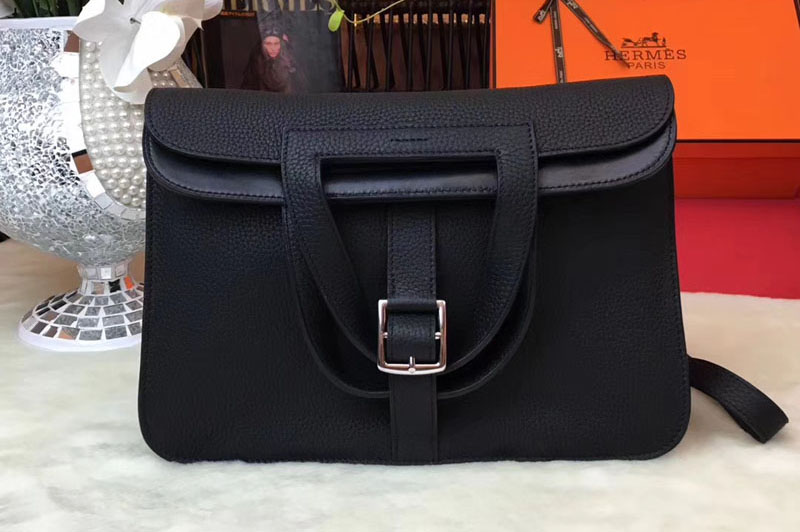
Locate an element on the screen. The height and width of the screenshot is (532, 800). painting of woman is located at coordinates (264, 49).